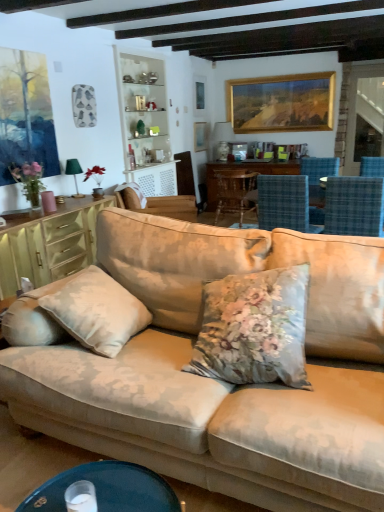
Question: Considering the positions of blue plaid chair at right, acting as the 1th chair starting from the front, and wooden table at center in the image, is blue plaid chair at right, acting as the 1th chair starting from the front, wider or thinner than wooden table at center?

Choices:
 (A) thin
 (B) wide

Answer: (A)

Question: From the image's perspective, is blue plaid chair at right, marked as the 4th chair in a back-to-front arrangement, located above or below wooden table at center?

Choices:
 (A) below
 (B) above

Answer: (A)

Question: Considering the real-world distances, which object is farthest from the matte green cabinet at left?

Choices:
 (A) beige fabric chair at center, the 2th chair positioned from the back
 (B) gold-framed painting at upper center, which is counted as the 2th picture frame, starting from the left
 (C) beige fabric couch at center
 (D) green fabric lampshade at left
 (E) matte black phone at center

Answer: (B)

Question: Considering the real-world distances, which object is farthest from the beige fabric chair at center, the 2th chair positioned from the back?

Choices:
 (A) blue plaid chair at center, marked as the second chair in a front-to-back arrangement
 (B) wooden chair at center, which appears as the fourth chair when viewed from the front
 (C) wooden picture frame at upper center, which is the first picture frame in left-to-right order
 (D) green fabric lampshade at left
 (E) matte black phone at center

Answer: (C)